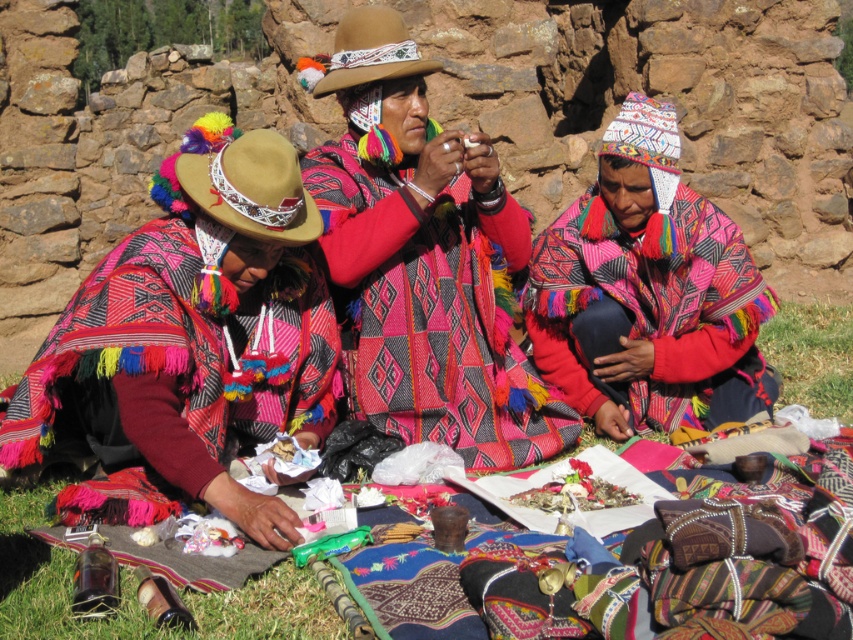
You are a photographer standing 30 feet away from the scene. You want to capture both the textured wool poncho at center and the brown felt cowboy hat at center in a single photo. Can you fit both items into your camera frame if your camera has a maximum field of view of 30 feet?

The distance between the textured wool poncho at center and the brown felt cowboy hat at center is 26.94 feet, which is less than the camera field of view of 30 feet. Therefore, both items can be captured in a single photo.

You are a photographer trying to capture the central figure. You notice the textured wool poncho at center and the knitted wool sweater at center. Which item should you focus on if you want to capture the one on the left side of the central figure?

The textured wool poncho at center is to the left of the knitted wool sweater at center, so focusing on the textured wool poncho at center will capture the item on the left side of the central figure.